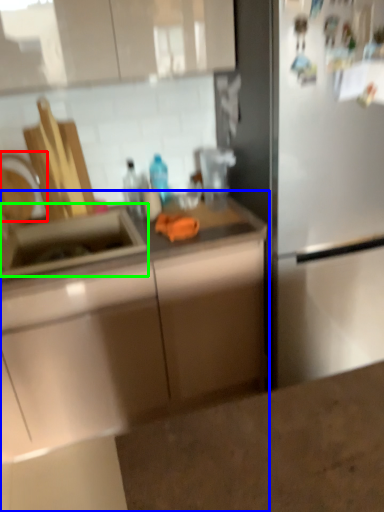
Question: Based on their relative distances, which object is nearer to faucet (highlighted by a red box)? Choose from countertop (highlighted by a blue box) and sink (highlighted by a green box).

Choices:
 (A) countertop
 (B) sink

Answer: (B)